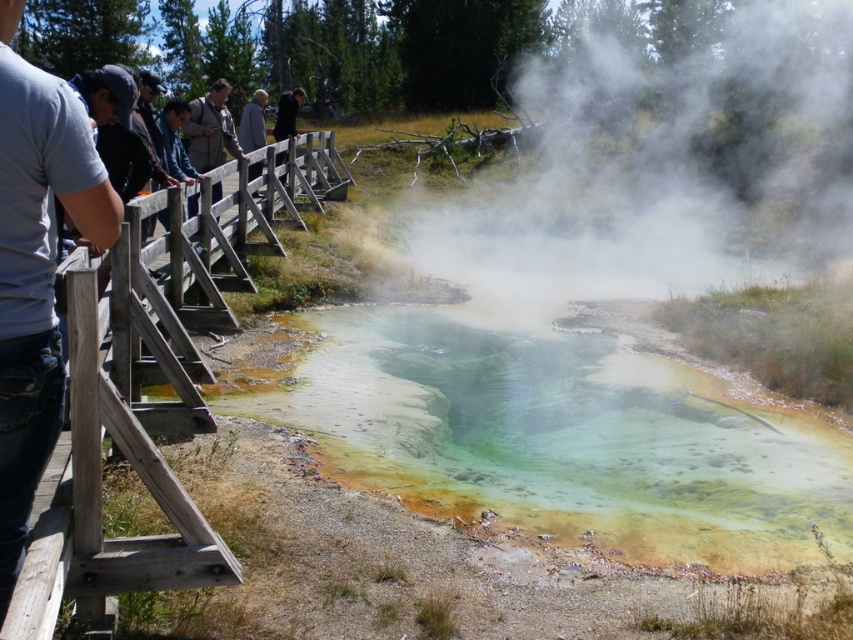
Can you confirm if green sedimentary water at center is smaller than weathered wood fence at left?

Correct, green sedimentary water at center occupies less space than weathered wood fence at left.

Is green sedimentary water at center taller than weathered wood fence at left?

No.

I want to click on green sedimentary water at center, so click(561, 435).

Is green sedimentary water at center below white translucent steam at upper center?

Correct, green sedimentary water at center is located below white translucent steam at upper center.

Based on the photo, who is higher up, green sedimentary water at center or white translucent steam at upper center?

white translucent steam at upper center is above.

Between point (590, 369) and point (624, 141), which one is positioned in front?

Point (590, 369) is in front.

Find the location of a particular element. The image size is (853, 640). green sedimentary water at center is located at coordinates (561, 435).

Does white translucent steam at upper center have a smaller size compared to weathered wood fence at left?

Actually, white translucent steam at upper center might be larger than weathered wood fence at left.

In the scene shown: Is white translucent steam at upper center below weathered wood fence at left?

Actually, white translucent steam at upper center is above weathered wood fence at left.

Locate an element on the screen. The width and height of the screenshot is (853, 640). white translucent steam at upper center is located at coordinates (660, 170).